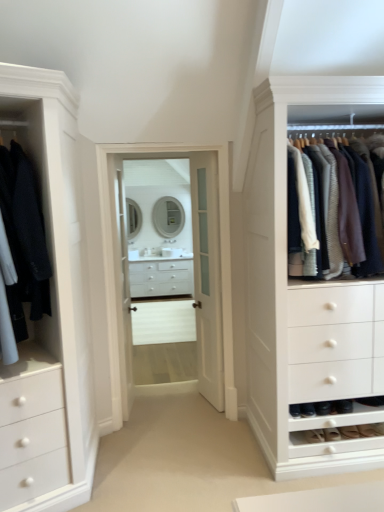
In order to face suede brown shoe at lower right, the 2th shoe when ordered from left to right, should I rotate leftwards or rightwards?

It's best to rotate right around 20.660 degrees.

Image resolution: width=384 pixels, height=512 pixels. What do you see at coordinates (349, 432) in the screenshot?
I see `suede brown shoe at lower right, arranged as the 1th shoe when viewed from the right` at bounding box center [349, 432].

What do you see at coordinates (334, 208) in the screenshot? I see `knit sweater at right, acting as the second clothing starting from the left` at bounding box center [334, 208].

What do you see at coordinates (207, 275) in the screenshot? Image resolution: width=384 pixels, height=512 pixels. I see `white glass door at center` at bounding box center [207, 275].

What do you see at coordinates (123, 296) in the screenshot? I see `clear glass door at center, the first glass door from the left` at bounding box center [123, 296].

This screenshot has width=384, height=512. I want to click on matte black coat at left, positioned as the 1th clothing in left-to-right order, so click(24, 238).

Between white glossy drawer at center and clear glass door at center, which is the 1th glass door in right-to-left order, which one has smaller width?

With smaller width is clear glass door at center, which is the 1th glass door in right-to-left order.

Is white glossy drawer at center positioned before clear glass door at center, the 2th glass door in the left-to-right sequence?

No.

From the image's perspective, which one is positioned higher, white glossy drawer at center or clear glass door at center, the 2th glass door in the left-to-right sequence?

clear glass door at center, the 2th glass door in the left-to-right sequence, appears higher in the image.

Considering the positions of objects white glossy drawer at center and clear glass door at center, which is the 1th glass door in right-to-left order, in the image provided, who is more to the right, white glossy drawer at center or clear glass door at center, which is the 1th glass door in right-to-left order,?

clear glass door at center, which is the 1th glass door in right-to-left order.

Considering the positions of objects clear glass door at center, the second glass door viewed from the right, and matte black coat at left, positioned as the 1th clothing in left-to-right order, in the image provided, who is more to the left, clear glass door at center, the second glass door viewed from the right, or matte black coat at left, positioned as the 1th clothing in left-to-right order,?

Positioned to the left is matte black coat at left, positioned as the 1th clothing in left-to-right order.

Locate an element on the screen. The image size is (384, 512). the 2nd glass door behind the matte black coat at left, which ranks as the 2th clothing in right-to-left order, starting your count from the anchor is located at coordinates (123, 296).

At what (x,y) coordinates should I click in order to perform the action: click on clothing located on the left of white glass door at center. Please return your answer as a coordinate pair (x, y). Looking at the image, I should click on (24, 238).

Can you confirm if white glass door at center is bigger than matte black coat at left, which ranks as the 2th clothing in right-to-left order?

No.

Could you measure the distance between white glass door at center and matte black coat at left, positioned as the 1th clothing in left-to-right order?

A distance of 1.41 meters exists between white glass door at center and matte black coat at left, positioned as the 1th clothing in left-to-right order.

From the image's perspective, which object appears higher, white glass door at center or matte black coat at left, positioned as the 1th clothing in left-to-right order?

matte black coat at left, positioned as the 1th clothing in left-to-right order, is shown above in the image.

From a real-world perspective, who is located lower, white glossy drawer at center or matte silver mirror at center, which is the 2th mirror in right-to-left order?

white glossy drawer at center.

Is there a large distance between white glossy drawer at center and matte silver mirror at center, which ranks as the 1th mirror in left-to-right order?

No, white glossy drawer at center is not far away from matte silver mirror at center, which ranks as the 1th mirror in left-to-right order.

Is white glossy drawer at center looking in the opposite direction of matte silver mirror at center, which is the 2th mirror in right-to-left order?

No.

Can you confirm if white glossy drawer at center is taller than matte black coat at left, positioned as the 1th clothing in left-to-right order?

No, white glossy drawer at center is not taller than matte black coat at left, positioned as the 1th clothing in left-to-right order.

In the scene shown: Considering the relative sizes of white glossy drawer at center and matte black coat at left, which ranks as the 2th clothing in right-to-left order, in the image provided, is white glossy drawer at center bigger than matte black coat at left, which ranks as the 2th clothing in right-to-left order,?

Correct, white glossy drawer at center is larger in size than matte black coat at left, which ranks as the 2th clothing in right-to-left order.

Is white glossy drawer at center not within matte black coat at left, positioned as the 1th clothing in left-to-right order?

Yes, white glossy drawer at center is outside of matte black coat at left, positioned as the 1th clothing in left-to-right order.

Is white glossy drawer at center far from matte black coat at left, which ranks as the 2th clothing in right-to-left order?

That's right, there is a large distance between white glossy drawer at center and matte black coat at left, which ranks as the 2th clothing in right-to-left order.

From a real-world perspective, who is located higher, suede brown shoe at lower right, the 2th shoe when ordered from left to right, or white glass mirror at center, the 1th mirror when ordered from right to left?

white glass mirror at center, the 1th mirror when ordered from right to left, from a real-world perspective.

Visually, is suede brown shoe at lower right, arranged as the 1th shoe when viewed from the right, positioned to the left or to the right of white glass mirror at center, the 2th mirror when ordered from left to right?

Clearly, suede brown shoe at lower right, arranged as the 1th shoe when viewed from the right, is on the right of white glass mirror at center, the 2th mirror when ordered from left to right, in the image.

Could white glass mirror at center, the 2th mirror when ordered from left to right, be considered to be inside suede brown shoe at lower right, arranged as the 1th shoe when viewed from the right?

No, white glass mirror at center, the 2th mirror when ordered from left to right, is not a part of suede brown shoe at lower right, arranged as the 1th shoe when viewed from the right.

Is suede brown shoe at lower right, the 2th shoe when ordered from left to right, oriented away from white glass mirror at center, the 2th mirror when ordered from left to right?

Yes, suede brown shoe at lower right, the 2th shoe when ordered from left to right, is facing away from white glass mirror at center, the 2th mirror when ordered from left to right.

Which object is thinner, white glossy drawer at center or clear glass door at center, the first glass door from the left?

clear glass door at center, the first glass door from the left.

In the image, is white glossy drawer at center positioned in front of or behind clear glass door at center, the second glass door viewed from the right?

Clearly, white glossy drawer at center is behind clear glass door at center, the second glass door viewed from the right.

Who is bigger, white glossy drawer at center or clear glass door at center, the first glass door from the left?

white glossy drawer at center.

Which point is more forward, (130, 278) or (122, 285)?

Positioned in front is point (122, 285).

Find the location of a particular element. the 2nd glass door positioned above the white glossy drawer at center (from the image's perspective) is located at coordinates (220, 255).

Locate an element on the screen. Image resolution: width=384 pixels, height=512 pixels. the 2nd clothing in front of the clear glass door at center, the first glass door from the left, starting your count from the anchor is located at coordinates (24, 238).

When comparing their distances from white glass door at center, does clear glass door at center, the first glass door from the left, or white glossy drawer at center seem closer?

clear glass door at center, the first glass door from the left.

Looking at the image, which one is located closer to white glass door at center, knit sweater at right, which appears as the 1th clothing when viewed from the right, or matte silver mirror at center, which ranks as the 1th mirror in left-to-right order?

The object closer to white glass door at center is knit sweater at right, which appears as the 1th clothing when viewed from the right.

Looking at the image, which one is located further to white glossy drawer at center, matte black coat at left, which ranks as the 2th clothing in right-to-left order, or suede brown shoe at lower right, arranged as the 1th shoe when viewed from the right?

suede brown shoe at lower right, arranged as the 1th shoe when viewed from the right.

Which object lies further to the anchor point matte silver mirror at center, which ranks as the 1th mirror in left-to-right order, clear glass door at center, the first glass door from the left, or white glass mirror at center, the 2th mirror when ordered from left to right?

clear glass door at center, the first glass door from the left, lies further to matte silver mirror at center, which ranks as the 1th mirror in left-to-right order, than the other object.

Which object lies further to the anchor point knit sweater at right, which appears as the 1th clothing when viewed from the right, suede shoe at lower right, positioned as the 2th shoe in right-to-left order, or white glass door at center?

The object further to knit sweater at right, which appears as the 1th clothing when viewed from the right, is suede shoe at lower right, positioned as the 2th shoe in right-to-left order.

Estimate the real-world distances between objects in this image. Which object is closer to white glass mirror at center, the 2th mirror when ordered from left to right, clear glass door at center, the 2th glass door in the left-to-right sequence, or white glossy drawer at center?

white glossy drawer at center is closer to white glass mirror at center, the 2th mirror when ordered from left to right.

From the image, which object appears to be nearer to clear glass door at center, which is the 1th glass door in right-to-left order, suede shoe at lower right, positioned as the 2th shoe in right-to-left order, or white glossy drawer at center?

suede shoe at lower right, positioned as the 2th shoe in right-to-left order, lies closer to clear glass door at center, which is the 1th glass door in right-to-left order, than the other object.

Estimate the real-world distances between objects in this image. Which object is further from white glossy drawer at center, suede brown shoe at lower right, arranged as the 1th shoe when viewed from the right, or white glass mirror at center, the 1th mirror when ordered from right to left?

suede brown shoe at lower right, arranged as the 1th shoe when viewed from the right, is further to white glossy drawer at center.

Locate an element on the screen. This screenshot has width=384, height=512. shoe situated between matte black coat at left, which ranks as the 2th clothing in right-to-left order, and knit sweater at right, which appears as the 1th clothing when viewed from the right, from left to right is located at coordinates (314, 436).

Where is `mirror between suede shoe at lower right, positioned as the 2th shoe in right-to-left order, and white glass mirror at center, the 2th mirror when ordered from left to right, along the z-axis`? This screenshot has height=512, width=384. mirror between suede shoe at lower right, positioned as the 2th shoe in right-to-left order, and white glass mirror at center, the 2th mirror when ordered from left to right, along the z-axis is located at coordinates (133, 218).

Image resolution: width=384 pixels, height=512 pixels. I want to click on door located between clear glass door at center, the second glass door viewed from the right, and suede brown shoe at lower right, the 2th shoe when ordered from left to right, in the left-right direction, so click(x=207, y=275).

Image resolution: width=384 pixels, height=512 pixels. I want to click on door between clear glass door at center, which is the 1th glass door in right-to-left order, and knit sweater at right, acting as the second clothing starting from the left, from left to right, so click(207, 275).